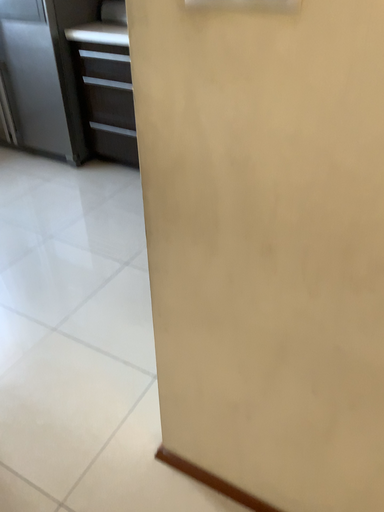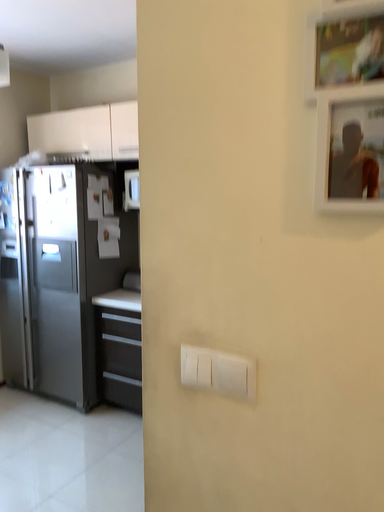
Question: Which way did the camera rotate in the video?

Choices:
 (A) rotated downward
 (B) rotated upward

Answer: (B)